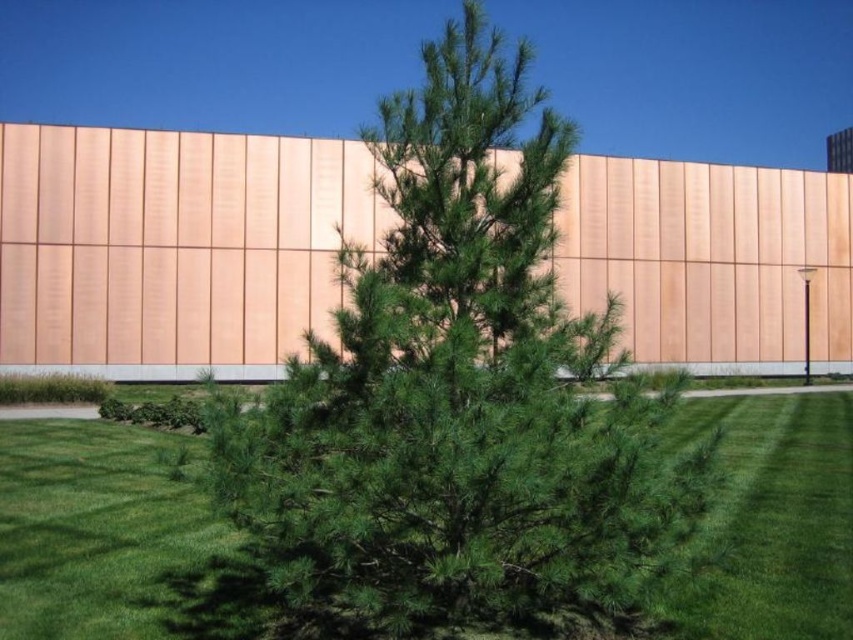
Can you confirm if green needle-like at center is positioned above green grass at center?

Indeed, green needle-like at center is positioned over green grass at center.

Does green needle-like at center have a lesser width compared to green grass at center?

Correct, green needle-like at center's width is less than green grass at center's.

Does point (451, 58) come behind point (241, 637)?

No.

Where is `green needle-like at center`? green needle-like at center is located at coordinates (459, 396).